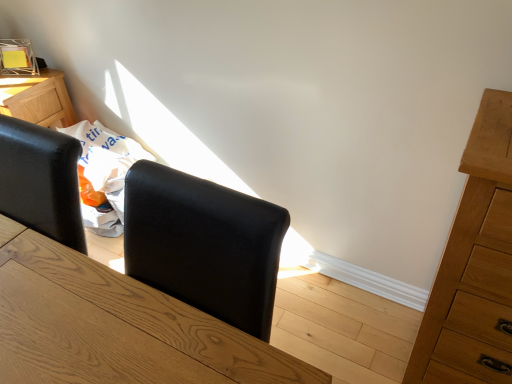
Question: From a real-world perspective, is natural wood dresser at right below black leather armchair at center?

Choices:
 (A) no
 (B) yes

Answer: (B)

Question: Is natural wood dresser at right far from black leather armchair at center?

Choices:
 (A) yes
 (B) no

Answer: (B)

Question: Is the position of natural wood dresser at right less distant than that of black leather armchair at center?

Choices:
 (A) no
 (B) yes

Answer: (A)

Question: Is natural wood dresser at right thinner than black leather armchair at center?

Choices:
 (A) no
 (B) yes

Answer: (A)

Question: From the image's perspective, is natural wood dresser at right on black leather armchair at center?

Choices:
 (A) no
 (B) yes

Answer: (B)

Question: Can you confirm if natural wood dresser at right is positioned to the left of black leather armchair at center?

Choices:
 (A) yes
 (B) no

Answer: (B)

Question: Can you confirm if black leather armchair at center is wider than natural wood dresser at right?

Choices:
 (A) yes
 (B) no

Answer: (B)

Question: From a real-world perspective, is black leather armchair at center below natural wood dresser at right?

Choices:
 (A) no
 (B) yes

Answer: (A)

Question: Is black leather armchair at center aimed at natural wood dresser at right?

Choices:
 (A) yes
 (B) no

Answer: (B)

Question: Is black leather armchair at center shorter than natural wood dresser at right?

Choices:
 (A) no
 (B) yes

Answer: (B)

Question: Is black leather armchair at center bigger than natural wood dresser at right?

Choices:
 (A) yes
 (B) no

Answer: (B)

Question: From the image's perspective, is black leather armchair at center on top of natural wood dresser at right?

Choices:
 (A) no
 (B) yes

Answer: (A)

Question: Would you say black leather armchair at center is to the left or to the right of natural wood dresser at right in the picture?

Choices:
 (A) left
 (B) right

Answer: (A)